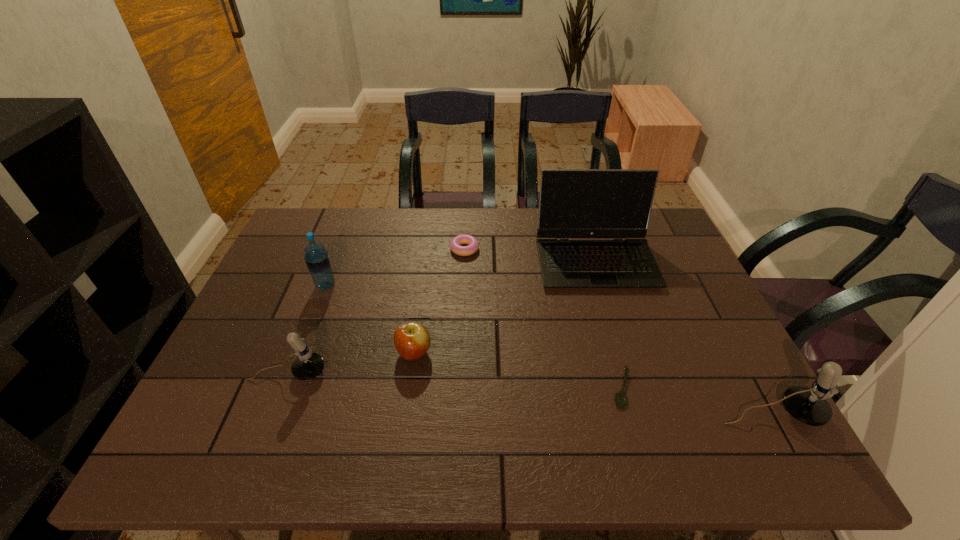
Identify the location of the farther microphone. Image resolution: width=960 pixels, height=540 pixels. tap(308, 365).

At what (x,y) coordinates should I click in order to perform the action: click on the left microphone. Please return your answer as a coordinate pair (x, y). Looking at the image, I should click on (308, 365).

The image size is (960, 540). In order to click on the right microphone in this screenshot , I will do `click(809, 406)`.

At what (x,y) coordinates should I click in order to perform the action: click on the nearer microphone. Please return your answer as a coordinate pair (x, y). This screenshot has width=960, height=540. Looking at the image, I should click on (809, 406).

The width and height of the screenshot is (960, 540). I want to click on the sixth tallest object, so click(x=455, y=244).

Locate an element on the screen. This screenshot has width=960, height=540. doughnut is located at coordinates click(x=455, y=244).

Identify the location of water bottle. The width and height of the screenshot is (960, 540). (317, 259).

Where is `laptop computer`? laptop computer is located at coordinates (574, 203).

Locate an element on the screen. The height and width of the screenshot is (540, 960). the fifth tallest object is located at coordinates (412, 340).

The image size is (960, 540). Find the location of `apple`. apple is located at coordinates (412, 340).